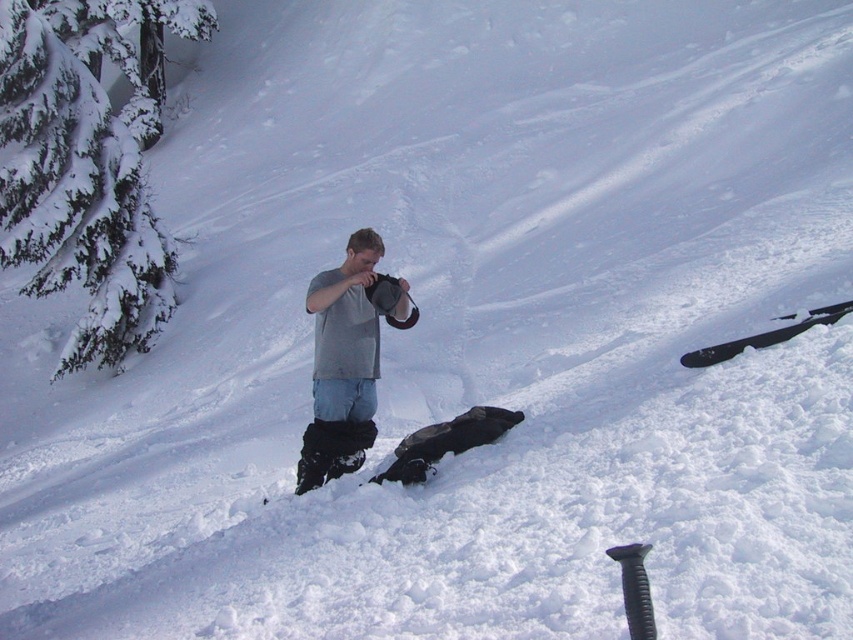
Question: Is green textured pine at upper left closer to the viewer compared to gray fabric snowboard at center?

Choices:
 (A) no
 (B) yes

Answer: (A)

Question: Does green textured pine at upper left have a larger size compared to gray fabric snowboard at center?

Choices:
 (A) no
 (B) yes

Answer: (A)

Question: In this image, where is green textured pine at upper left located relative to gray fabric snowboard at center?

Choices:
 (A) left
 (B) right

Answer: (A)

Question: Which of the following is the farthest from the observer?

Choices:
 (A) gray fabric snowboard at center
 (B) green textured pine at upper left

Answer: (B)